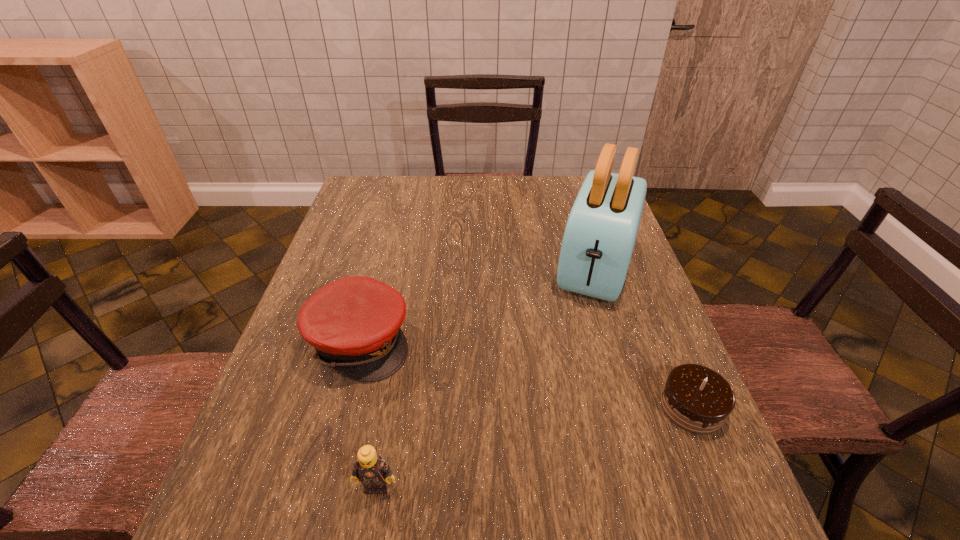
Where is `the nearest object`? The height and width of the screenshot is (540, 960). the nearest object is located at coordinates (370, 469).

The image size is (960, 540). I want to click on the shortest object, so click(697, 399).

Image resolution: width=960 pixels, height=540 pixels. What are the coordinates of `the tallest object` in the screenshot? It's located at (600, 234).

You are a GUI agent. You are given a task and a screenshot of the screen. Output one action in this format:
    pyautogui.click(x=<x>, y=<y>)
    Task: Click on the cap
    This screenshot has height=540, width=960.
    Given the screenshot: What is the action you would take?
    354,323

Where is `blank space located 0.370m on the left of the shortest object`? blank space located 0.370m on the left of the shortest object is located at coordinates (479, 407).

At what (x,y) coordinates should I click in order to perform the action: click on free region located on the side of the tallest object with the lever. Please return your answer as a coordinate pair (x, y). Looking at the image, I should click on (557, 411).

Locate an element on the screen. This screenshot has height=540, width=960. vacant space located 0.210m on the side of the tallest object with the lever is located at coordinates (569, 370).

Locate an element on the screen. free point located 0.400m on the side of the tallest object with the lever is located at coordinates click(546, 446).

You are a GUI agent. You are given a task and a screenshot of the screen. Output one action in this format:
    pyautogui.click(x=<x>, y=<y>)
    Task: Click on the vacant position located on the front of the cap with an emblem
    
    Given the screenshot: What is the action you would take?
    coord(505,401)

Locate an element on the screen. The width and height of the screenshot is (960, 540). free space located 0.190m on the front of the cap with an emblem is located at coordinates (479, 390).